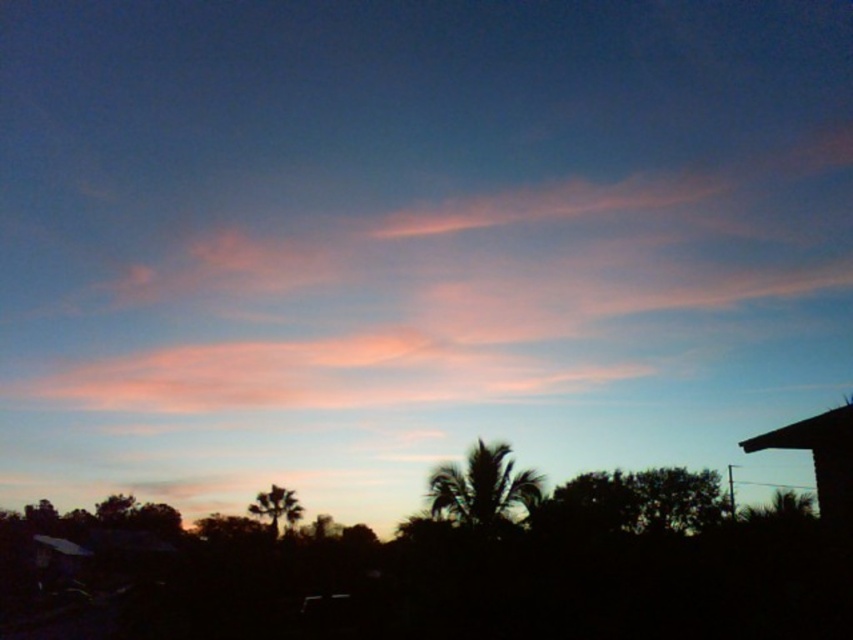
Question: Is silhouette palm tree at center wider than sandy brown palm tree at center?

Choices:
 (A) yes
 (B) no

Answer: (B)

Question: Which of the following is the farthest from the observer?

Choices:
 (A) sandy brown palm tree at center
 (B) silhouette palm tree at center

Answer: (A)

Question: Is silhouette palm tree at center behind sandy brown palm tree at center?

Choices:
 (A) no
 (B) yes

Answer: (A)

Question: Does silhouette palm tree at center have a larger size compared to sandy brown palm tree at center?

Choices:
 (A) no
 (B) yes

Answer: (A)